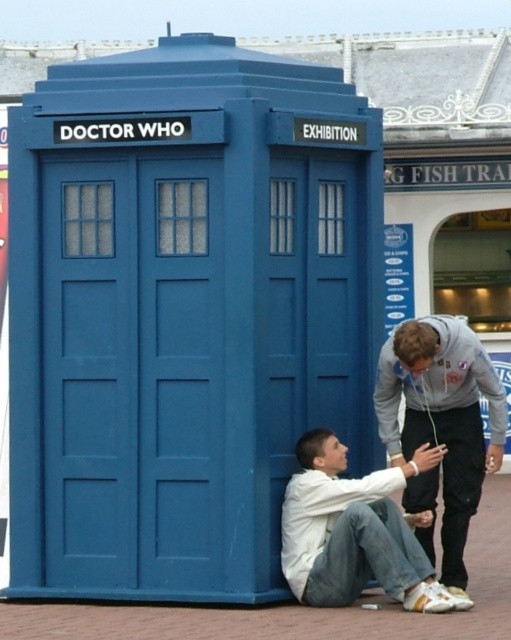
Is gray hoodie at lower right in front of white matte shirt at lower center?

No, gray hoodie at lower right is behind white matte shirt at lower center.

Does gray hoodie at lower right appear on the left side of white matte shirt at lower center?

In fact, gray hoodie at lower right is to the right of white matte shirt at lower center.

The image size is (511, 640). What are the coordinates of `gray hoodie at lower right` in the screenshot? It's located at (443, 419).